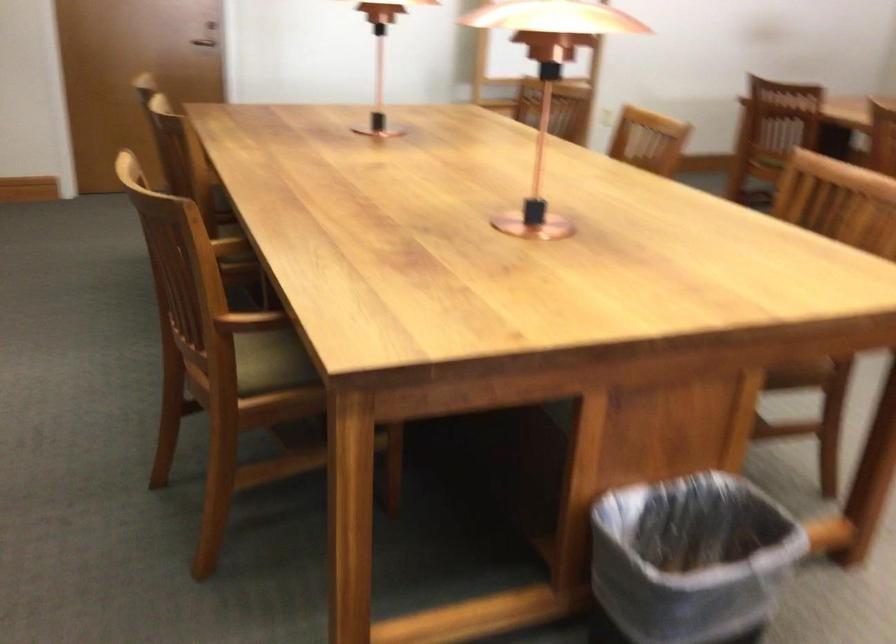
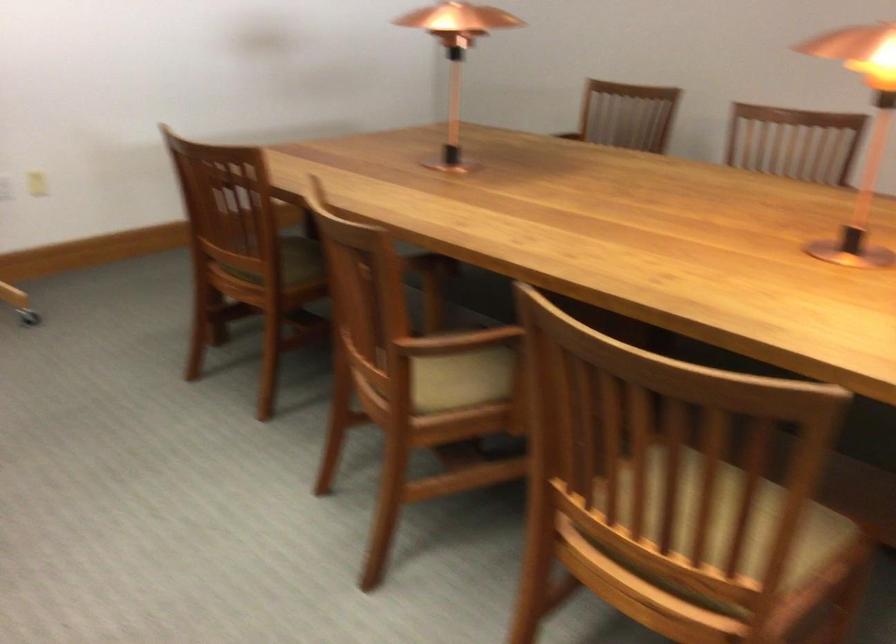
Question: I am providing you with two images of the same scene from different viewpoints. After the viewpoint changes to image2, which objects are now occluded?

Choices:
 (A) wall light switch
 (B) water valve handle
 (C) chair sitting surface
 (D) copper table lamp

Answer: (C)